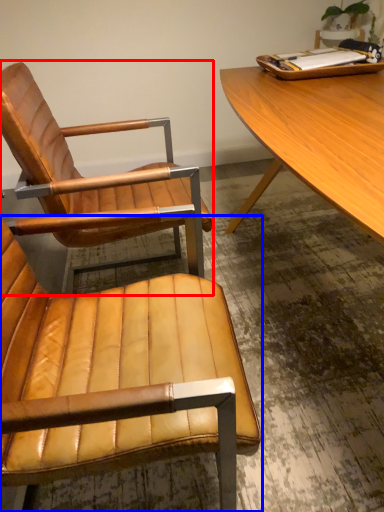
Question: Among these objects, which one is nearest to the camera, chair (highlighted by a red box) or chair (highlighted by a blue box)?

Choices:
 (A) chair
 (B) chair

Answer: (B)